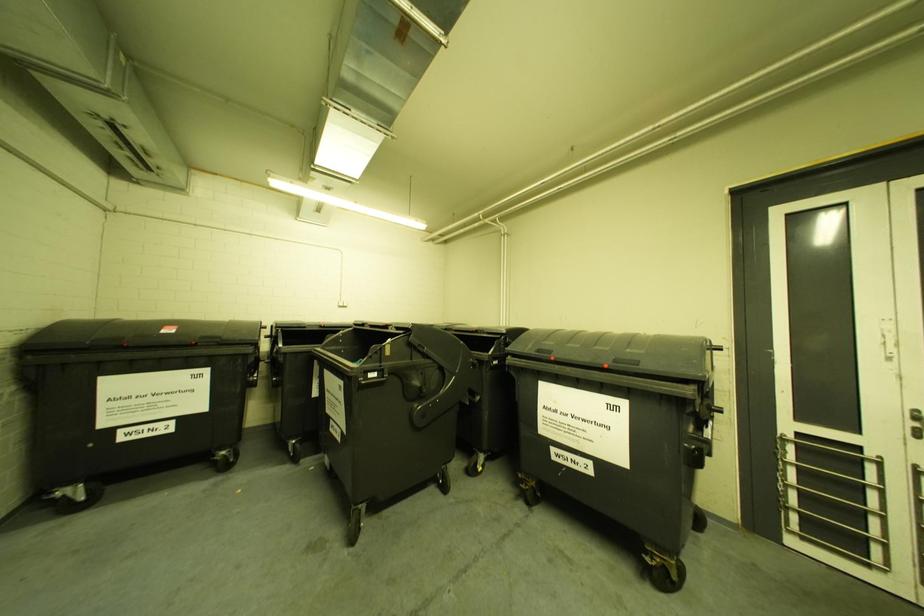
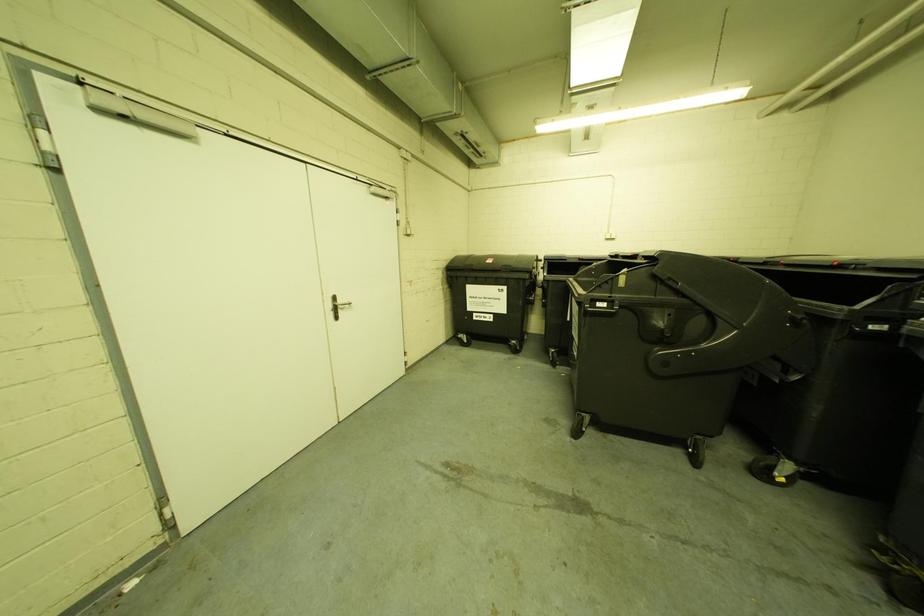
Question: Based on the continuous images, in which direction is the camera rotating? Reply with the corresponding letter.

Choices:
 (A) Left
 (B) Right
 (C) Up
 (D) Down

Answer: (A)